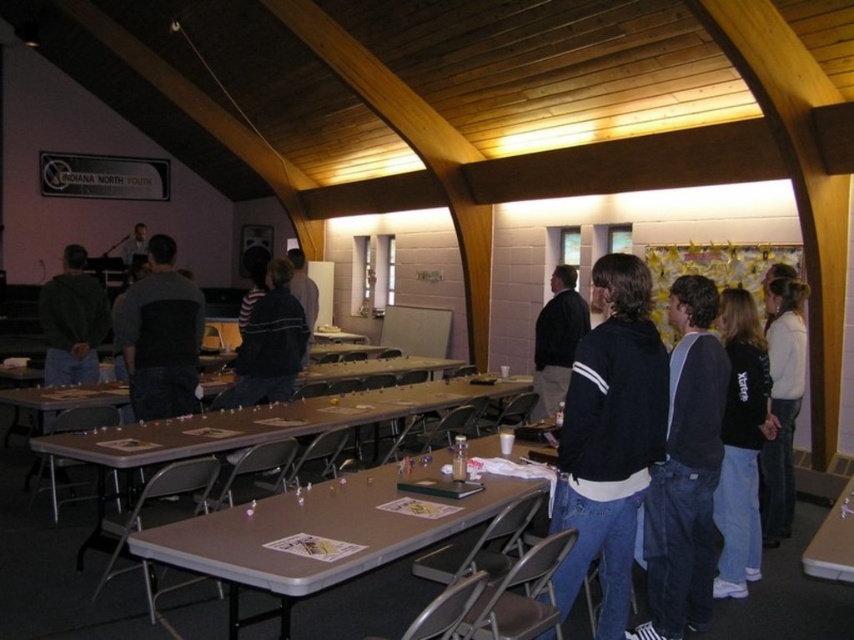
You are standing in the room and want to pick up the white sweater at right. Where should you look to find it?

The white sweater at right is located at the coordinates point [782,403] in the room.

You are organizing a workshop and need to place a name tag on the table. The name tag is 10 cm wide. Can the smooth white table at lower right accommodate the name tag without overlapping the white sweater at right?

The white sweater at right is positioned on the right side of the smooth white table at lower right. Since the sweater is on the right side, placing the name tag on the left side of the table would prevent overlap. Therefore, the smooth white table at lower right can accommodate the name tag without overlapping the white sweater at right.

You are organizing a small event and need to move the black fleece jacket at lower right to make space for attendees. Can you move it behind the metallic gray table at center without blocking the entrance?

The metallic gray table at center is in front of the black fleece jacket at lower right, so moving the jacket behind the table would place it further away from the entrance, thus not blocking it.